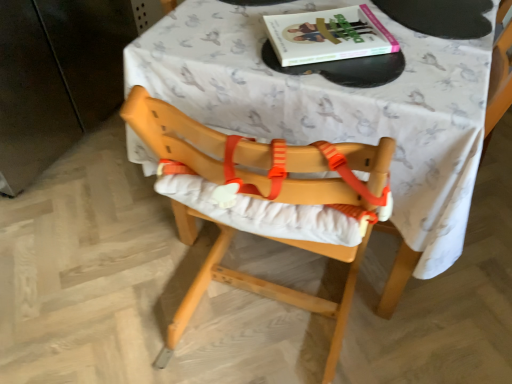
Where is `vacant space to the right of natural wood highchair at center`? Image resolution: width=512 pixels, height=384 pixels. vacant space to the right of natural wood highchair at center is located at coordinates (422, 319).